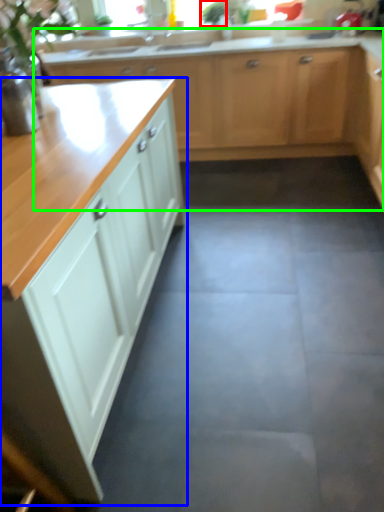
Question: Considering the real-world distances, which object is closest to plant (highlighted by a red box)? cabinetry (highlighted by a blue box) or cabinetry (highlighted by a green box).

Choices:
 (A) cabinetry
 (B) cabinetry

Answer: (B)